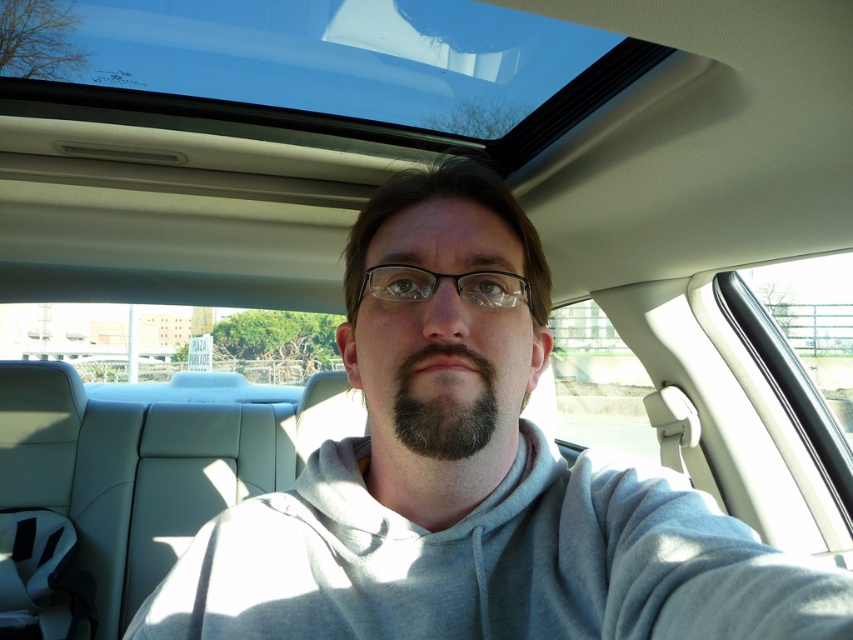
Which is in front, point (238, 40) or point (413, 433)?

Positioned in front is point (413, 433).

Which is in front, point (340, 81) or point (485, 385)?

Point (485, 385) is more forward.

Where is `transparent glass sunroof at upper center`? transparent glass sunroof at upper center is located at coordinates click(326, 67).

Does transparent glass sunroof at upper center have a greater height compared to black plastic glasses at center?

Correct, transparent glass sunroof at upper center is much taller as black plastic glasses at center.

Does transparent glass sunroof at upper center appear on the right side of black plastic glasses at center?

In fact, transparent glass sunroof at upper center is to the left of black plastic glasses at center.

The height and width of the screenshot is (640, 853). Identify the location of transparent glass sunroof at upper center. (326, 67).

Is dark brown fuzzy beard at center below black plastic glasses at center?

Indeed, dark brown fuzzy beard at center is positioned under black plastic glasses at center.

Does point (473, 416) lie in front of point (436, 275)?

Yes, it is in front of point (436, 275).

Which is behind, point (463, 422) or point (427, 296)?

Point (427, 296)

The image size is (853, 640). Find the location of `dark brown fuzzy beard at center`. dark brown fuzzy beard at center is located at coordinates (444, 408).